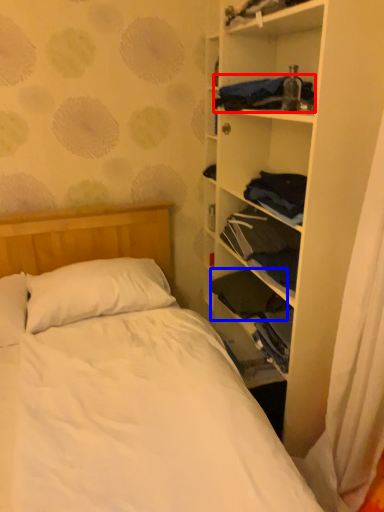
Question: Which object appears closest to the camera in this image, clothing (highlighted by a red box) or clothing (highlighted by a blue box)?

Choices:
 (A) clothing
 (B) clothing

Answer: (A)